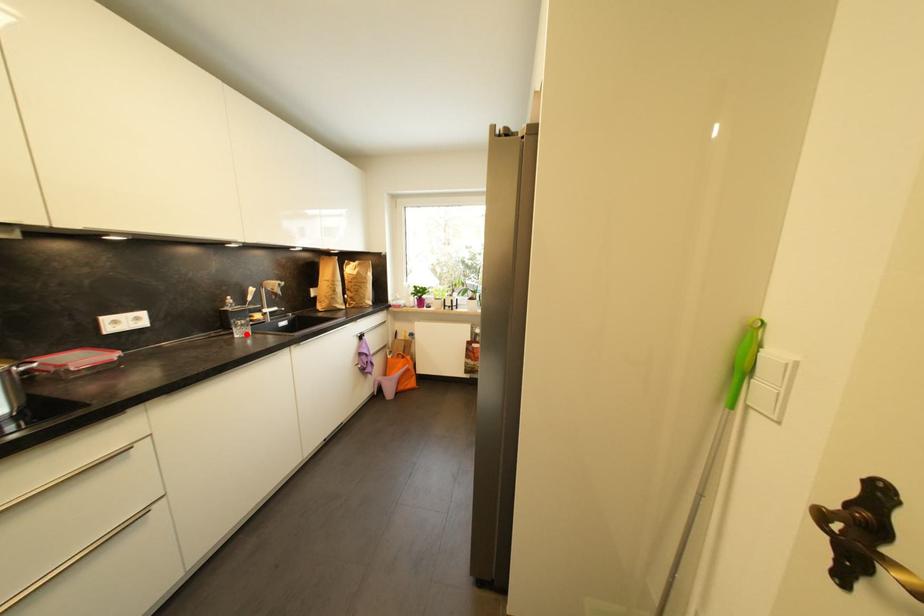
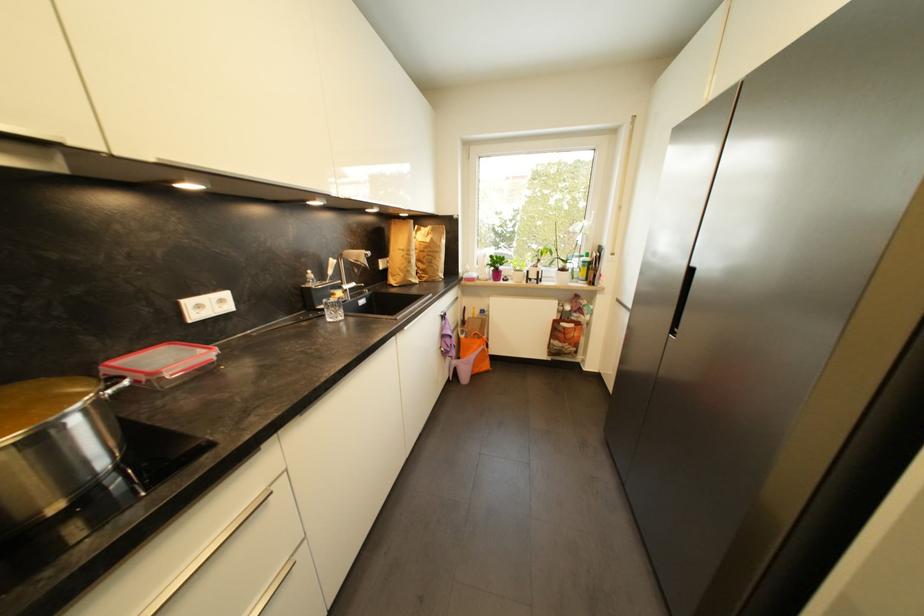
Locate, in the second image, the point that corresponds to the highlighted location in the first image.

(339, 317)